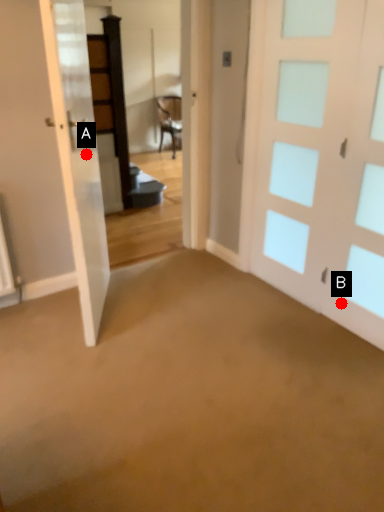
Question: Two points are circled on the image, labeled by A and B beside each circle. Which point is farther from the camera taking this photo?

Choices:
 (A) A is further
 (B) B is further

Answer: (A)